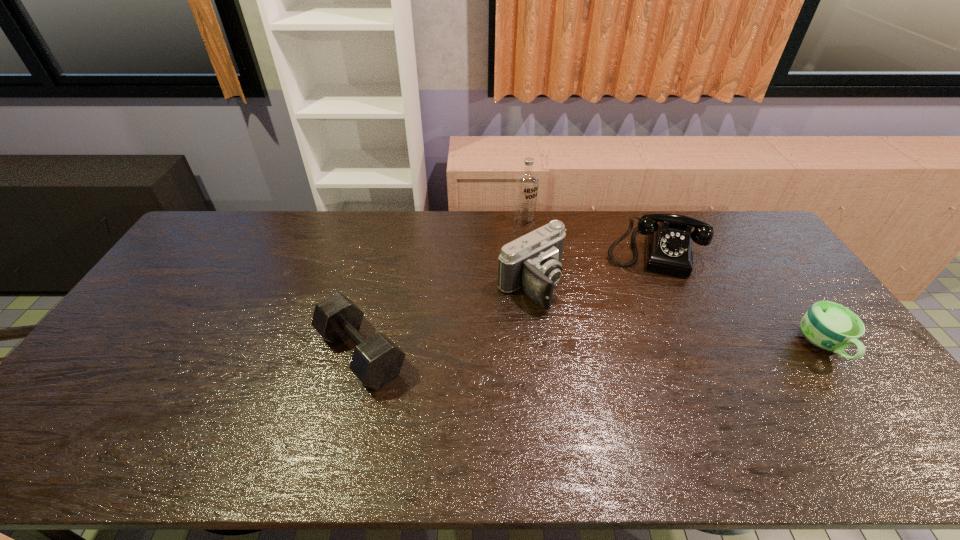
Identify the location of the leftmost object. (377, 360).

Identify the location of the fourth tallest object. Image resolution: width=960 pixels, height=540 pixels. [x=377, y=360].

This screenshot has height=540, width=960. I want to click on cup, so click(x=827, y=325).

Locate an element on the screen. the shortest object is located at coordinates (827, 325).

Where is `the tallest object`? This screenshot has height=540, width=960. the tallest object is located at coordinates (526, 191).

Image resolution: width=960 pixels, height=540 pixels. What are the coordinates of `camera` in the screenshot? It's located at (532, 262).

Where is `telephone`? telephone is located at coordinates (668, 243).

You are a GUI agent. You are given a task and a screenshot of the screen. Output one action in this format:
    pyautogui.click(x=<x>, y=<y>)
    Task: Click on the blank space located on the right of the dumbbell
    
    Given the screenshot: What is the action you would take?
    click(x=552, y=353)

The image size is (960, 540). In order to click on vacant area situated on the left of the shortest object in this screenshot , I will do `click(758, 346)`.

Identify the location of vacant space located 0.260m on the front label of the vodka. The image size is (960, 540). (558, 275).